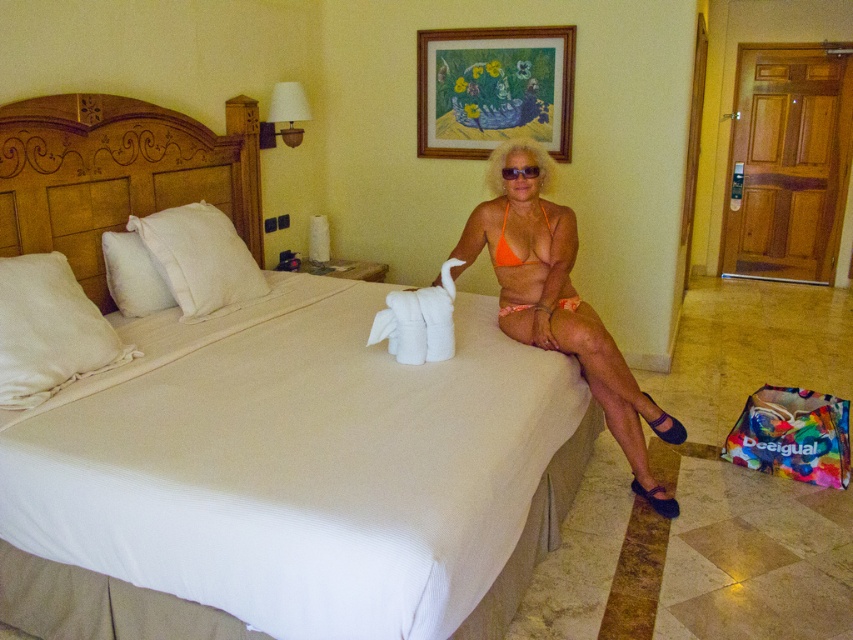
Between white cotton pillow at left and orange matte bikini top at center, which one has more height?

With more height is white cotton pillow at left.

The width and height of the screenshot is (853, 640). In order to click on white cotton pillow at left in this screenshot , I will do `click(199, 257)`.

Between point (199, 205) and point (506, 208), which one is positioned in front?

Point (506, 208)

Locate an element on the screen. The width and height of the screenshot is (853, 640). white cotton pillow at left is located at coordinates (199, 257).

Who is taller, white cotton pillow at left or black plastic sunglasses at center?

white cotton pillow at left

Who is more distant from viewer, (161, 227) or (523, 164)?

The point (161, 227) is more distant.

The image size is (853, 640). Identify the location of white cotton pillow at left. (199, 257).

Does white textured bed at center have a larger size compared to orange bikini at center?

Yes.

Is white textured bed at center to the right of orange bikini at center from the viewer's perspective?

No, white textured bed at center is not to the right of orange bikini at center.

Locate an element on the screen. This screenshot has width=853, height=640. white textured bed at center is located at coordinates (115, 172).

Image resolution: width=853 pixels, height=640 pixels. Identify the location of white textured bed at center. (115, 172).